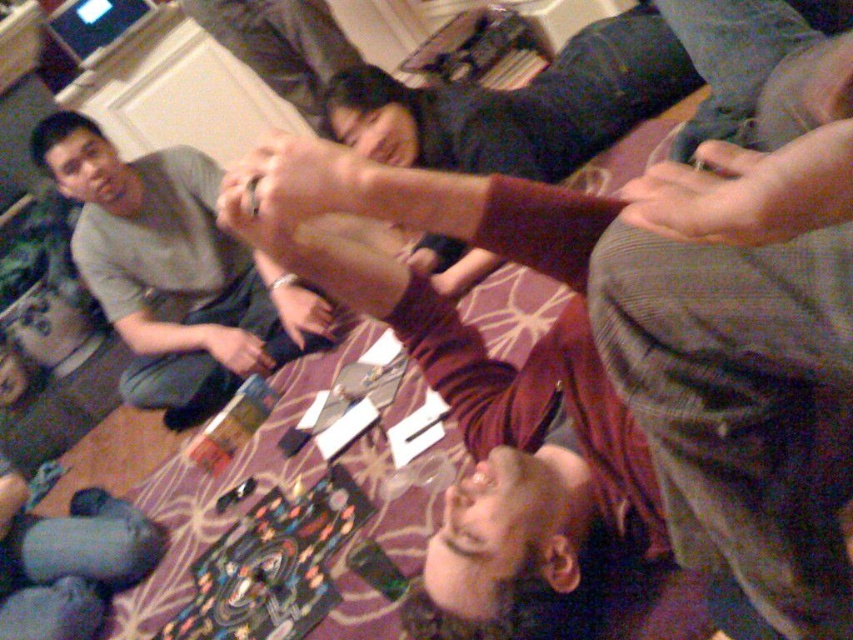
Question: Can you confirm if gray cotton shirt at upper left is positioned above dark gray sweater at upper center?

Choices:
 (A) yes
 (B) no

Answer: (B)

Question: Among these points, which one is farthest from the camera?

Choices:
 (A) (306, 22)
 (B) (416, 246)

Answer: (A)

Question: Can you confirm if maroon sweater at center is bigger than dark gray sweater at upper center?

Choices:
 (A) yes
 (B) no

Answer: (A)

Question: Estimate the real-world distances between objects in this image. Which object is farther from the dark gray sweater at upper center?

Choices:
 (A) maroon sweater at center
 (B) gray cotton shirt at upper left

Answer: (A)

Question: Does gray cotton shirt at upper left have a lesser width compared to dark gray sweater at upper center?

Choices:
 (A) no
 (B) yes

Answer: (A)

Question: Among these objects, which one is farthest from the camera?

Choices:
 (A) maroon sweater at center
 (B) dark gray sweater at upper center
 (C) gray cotton shirt at upper left

Answer: (B)